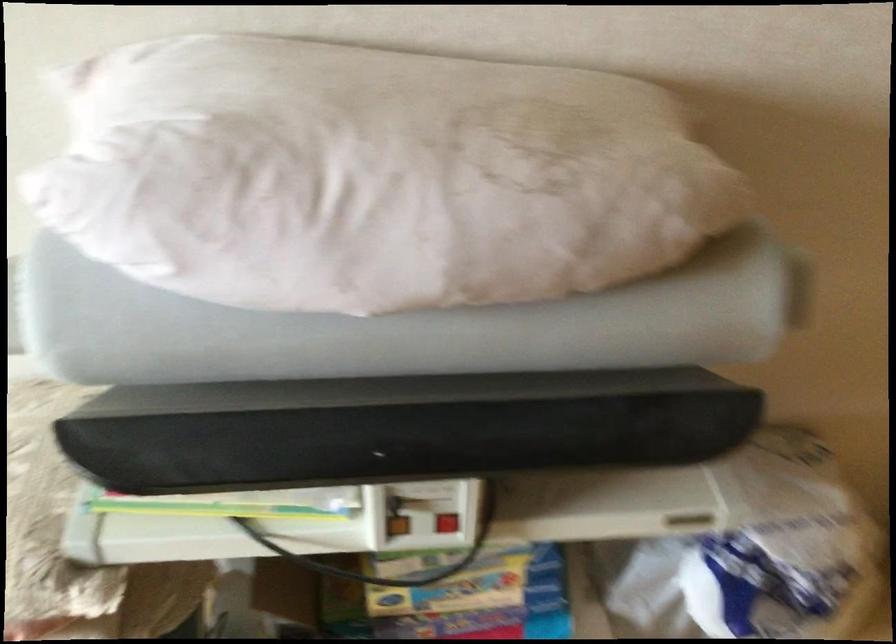
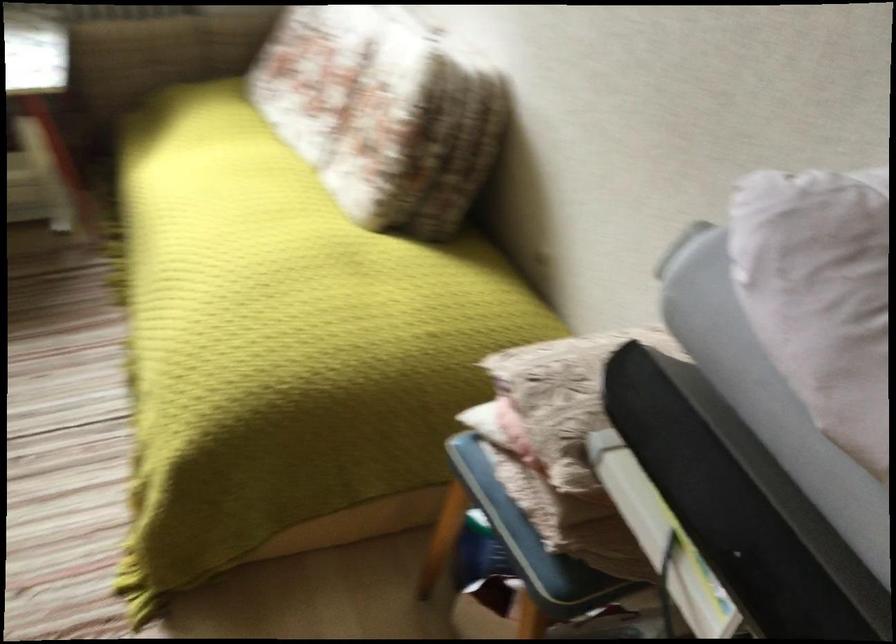
Locate, in the second image, the point that corresponds to point (229, 229) in the first image.

(821, 295)